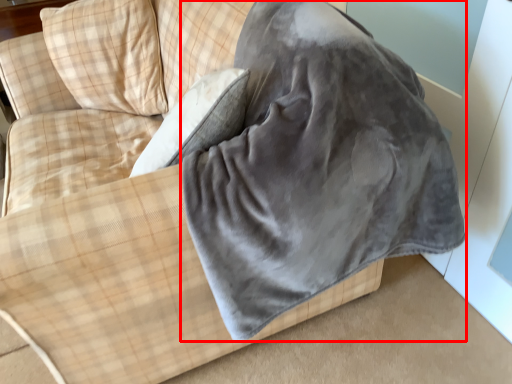
Question: From the image's perspective, where is sleeping bag (annotated by the red box) located relative to pillow?

Choices:
 (A) above
 (B) below

Answer: (B)